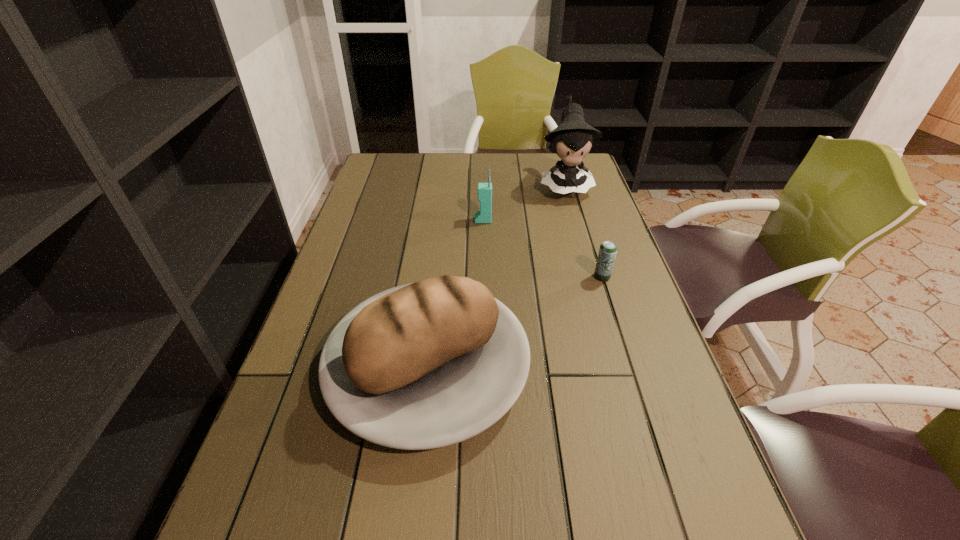
I want to click on the farthest object, so click(572, 140).

Find the location of `the tallest object`. the tallest object is located at coordinates (572, 140).

Where is `the nearest object`? Image resolution: width=960 pixels, height=540 pixels. the nearest object is located at coordinates (425, 365).

The width and height of the screenshot is (960, 540). I want to click on cellular telephone, so click(484, 214).

Where is `the second nearest object`? This screenshot has height=540, width=960. the second nearest object is located at coordinates (607, 253).

I want to click on beer can, so click(x=607, y=253).

Where is `vacant space located at the face of the doll`? vacant space located at the face of the doll is located at coordinates (589, 271).

Where is `free space located 0.090m on the front of the nearest object`? The image size is (960, 540). free space located 0.090m on the front of the nearest object is located at coordinates (411, 521).

The width and height of the screenshot is (960, 540). I want to click on vacant region located on the keypad of the cellular telephone, so click(396, 220).

You are a GUI agent. You are given a task and a screenshot of the screen. Output one action in this format:
    pyautogui.click(x=<x>, y=<y>)
    Task: Click on the vacant point located on the keypad of the cellular telephone
    The height and width of the screenshot is (540, 960).
    Given the screenshot: What is the action you would take?
    pyautogui.click(x=416, y=220)